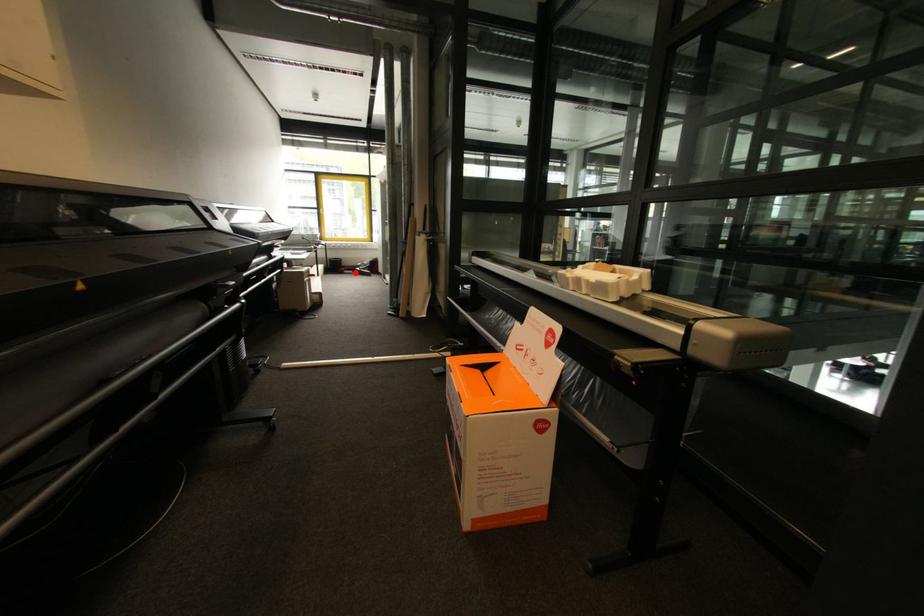
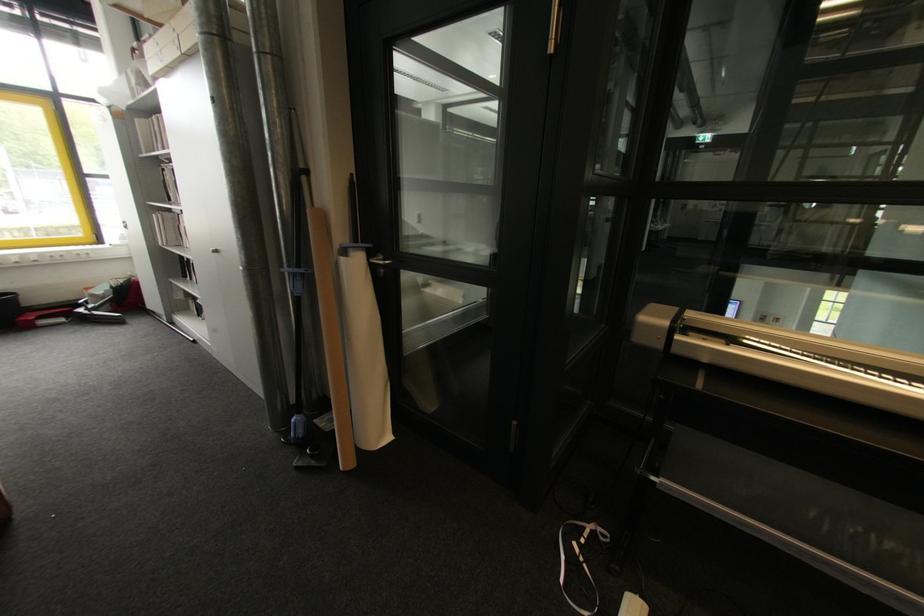
Find the pixel in the second image that matches the highlighted location in the first image.

(66, 321)